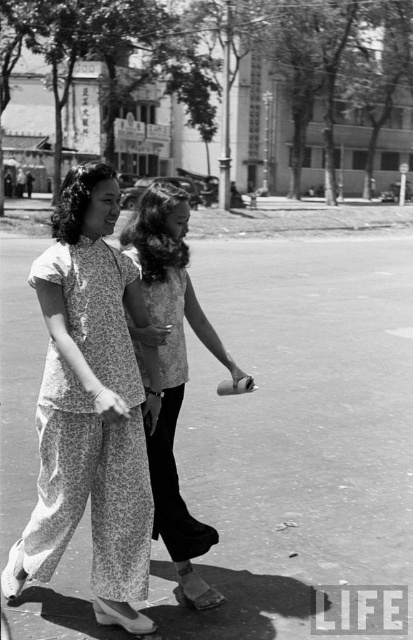
Question: Is printed cotton dress at center wider than floral fabric dress at center?

Choices:
 (A) yes
 (B) no

Answer: (A)

Question: Can you confirm if printed cotton dress at center is smaller than floral fabric dress at center?

Choices:
 (A) no
 (B) yes

Answer: (A)

Question: Among these objects, which one is farthest from the camera?

Choices:
 (A) floral fabric dress at center
 (B) printed cotton dress at center

Answer: (A)

Question: Which point is closer to the camera taking this photo?

Choices:
 (A) (149, 230)
 (B) (80, 381)

Answer: (B)

Question: Is printed cotton dress at center below floral fabric dress at center?

Choices:
 (A) no
 (B) yes

Answer: (B)